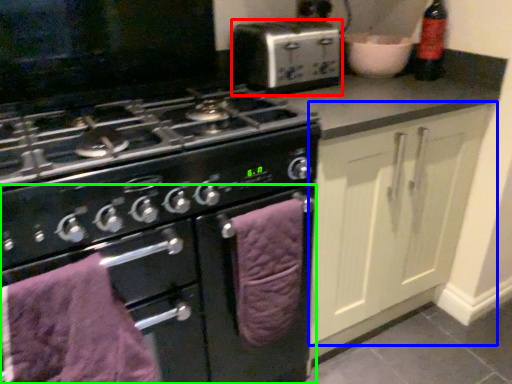
Question: Which object is the farthest from kitchen appliance (highlighted by a red box)? Choose among these: cabinetry (highlighted by a blue box) or oven (highlighted by a green box).

Choices:
 (A) cabinetry
 (B) oven

Answer: (B)